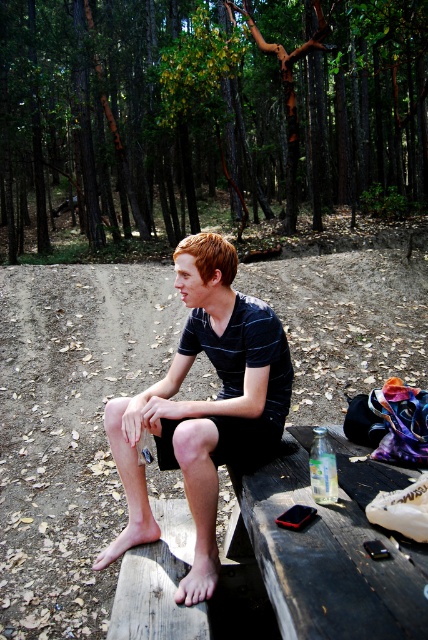
You are standing at the picnic table and want to walk along the brown dirt track at center. Which direction should you go relative to the black striped shirt at center?

To follow the brown dirt track at center from the picnic table, you should head to the left side of the black striped shirt at center since the track is positioned to the left of the shirt.

You are hiking in the forest and want to follow the dirt track to reach a campsite. You see the brown bark trees at upper center blocking your view. Can you tell if the brown dirt track at center is visible beyond the trees?

The brown dirt track at center is behind brown bark trees at upper center, so it is not visible beyond the trees. You might need to move closer or around the trees to see the track.

Based on the scene description, where exactly are the brown bark trees at upper center located in terms of their 2D coordinates?

The brown bark trees at upper center are located at the 2D coordinates point (x=205, y=116).